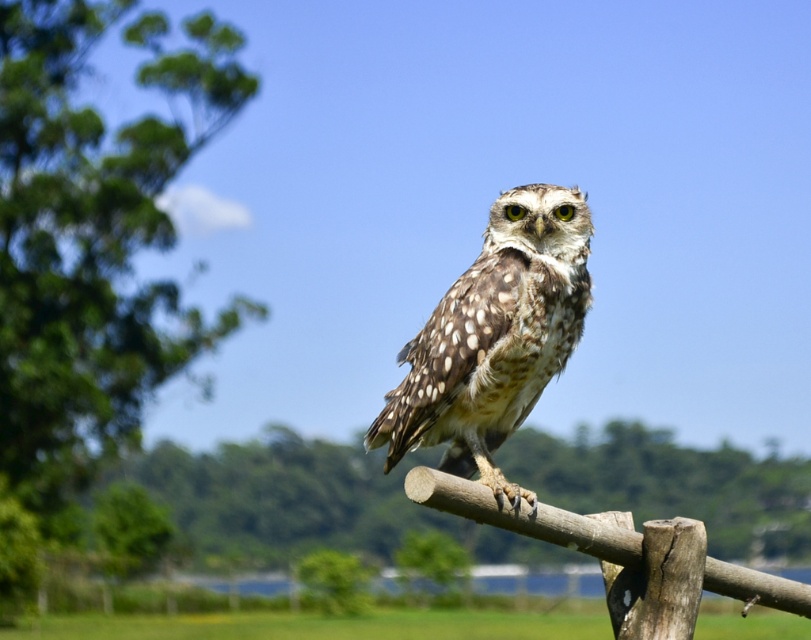
Based on the photo, is speckled feathered owl at center positioned at the back of brown rough wood at center?

Yes, it is behind brown rough wood at center.

Is speckled feathered owl at center below brown rough wood at center?

No, speckled feathered owl at center is not below brown rough wood at center.

Measure the distance between point [462,332] and camera.

The distance of point [462,332] from camera is 19.24 feet.

The width and height of the screenshot is (811, 640). In order to click on speckled feathered owl at center in this screenshot , I will do `click(494, 339)`.

Looking at this image, who is more distant from viewer, (135,132) or (500,392)?

Positioned behind is point (135,132).

Which is more to the right, green leafy tree at upper left or speckled feathered owl at center?

From the viewer's perspective, speckled feathered owl at center appears more on the right side.

What do you see at coordinates (93, 236) in the screenshot? This screenshot has width=811, height=640. I see `green leafy tree at upper left` at bounding box center [93, 236].

You are a GUI agent. You are given a task and a screenshot of the screen. Output one action in this format:
    pyautogui.click(x=<x>, y=<y>)
    Task: Click on the green leafy tree at upper left
    Image resolution: width=811 pixels, height=640 pixels.
    Given the screenshot: What is the action you would take?
    (x=93, y=236)

Does green leafy tree at upper left have a lesser width compared to brown rough wood at center?

Incorrect, green leafy tree at upper left's width is not less than brown rough wood at center's.

Who is more forward, (x=161, y=186) or (x=610, y=550)?

Positioned in front is point (x=610, y=550).

Who is more distant from viewer, [9,268] or [787,608]?

Point [9,268]

What are the coordinates of `green leafy tree at upper left` in the screenshot? It's located at (93, 236).